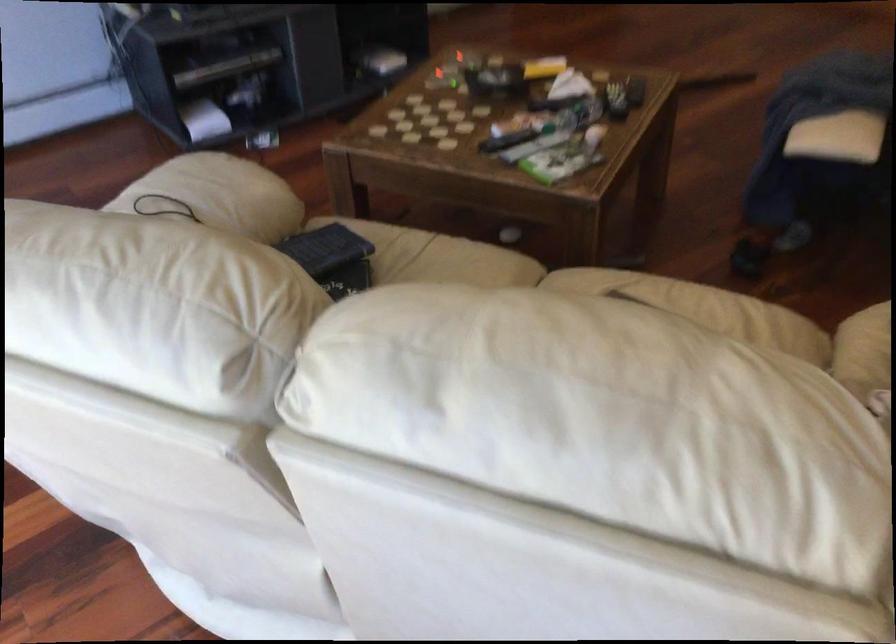
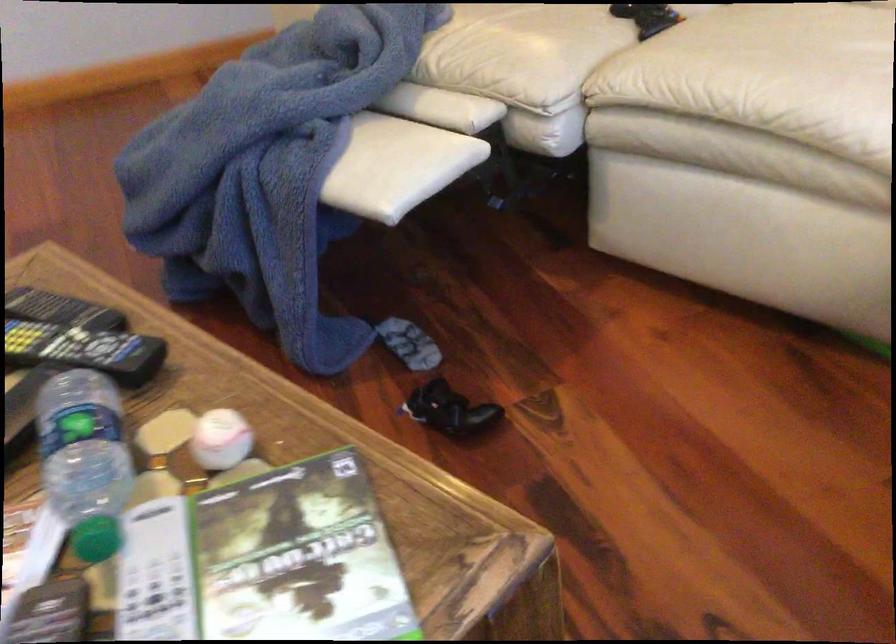
Locate, in the second image, the point that corresponds to (536,120) in the first image.

(96, 538)